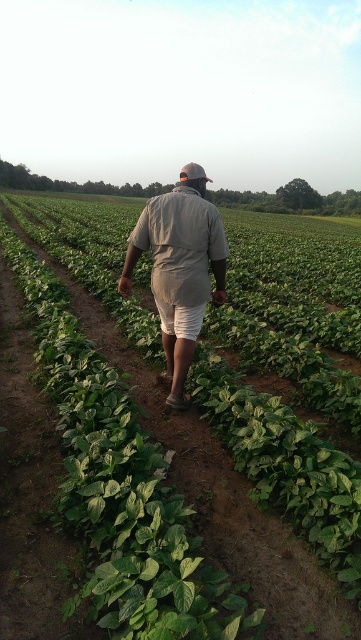
Which is more to the right, green leafy plant at center or khaki fabric shirt at center?

Positioned to the right is khaki fabric shirt at center.

Looking at this image, is the position of green leafy plant at center less distant than that of khaki fabric shirt at center?

That is True.

This screenshot has height=640, width=361. In order to click on green leafy plant at center in this screenshot , I will do `click(285, 465)`.